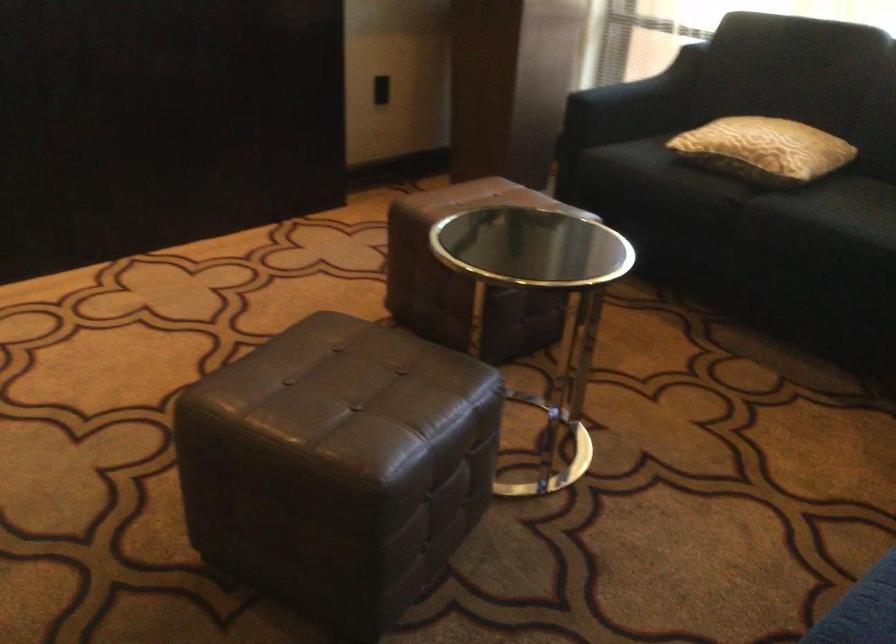
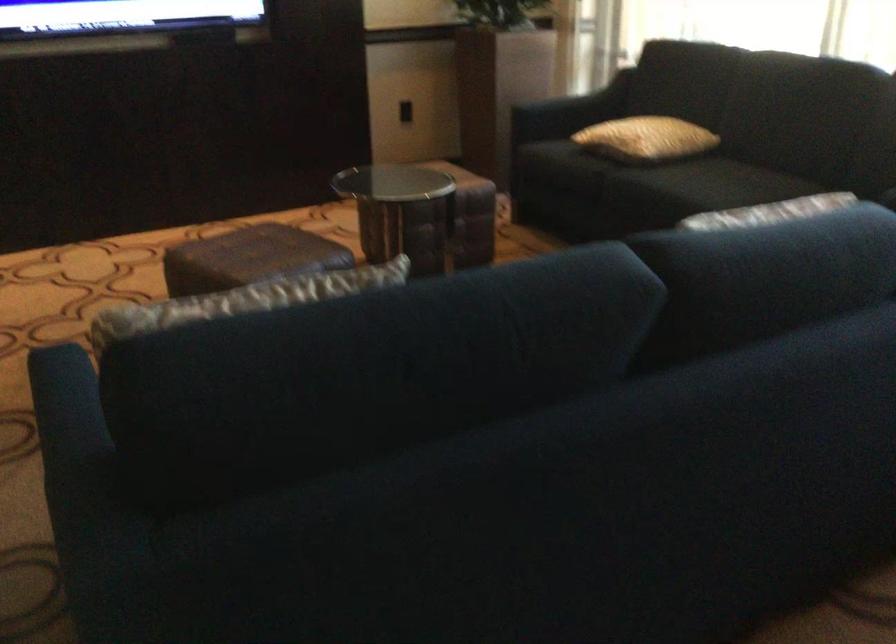
Looking at this image, which direction would the cameraman need to move to produce the second image?

The cameraman moved toward right, backward.